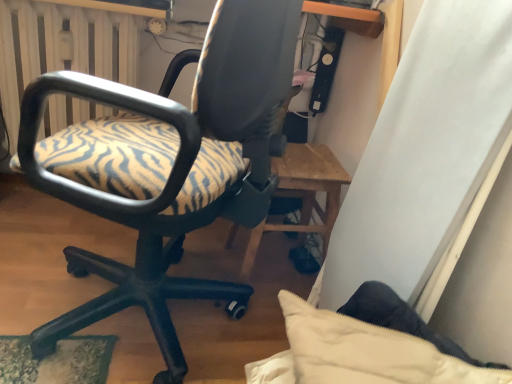
Question: From the image's perspective, is zebra-patterned fabric office chair at left over white radiator at upper left?

Choices:
 (A) no
 (B) yes

Answer: (A)

Question: Would you consider zebra-patterned fabric office chair at left to be distant from white radiator at upper left?

Choices:
 (A) no
 (B) yes

Answer: (A)

Question: Considering the relative sizes of zebra-patterned fabric office chair at left and white radiator at upper left in the image provided, is zebra-patterned fabric office chair at left smaller than white radiator at upper left?

Choices:
 (A) yes
 (B) no

Answer: (B)

Question: Does zebra-patterned fabric office chair at left turn towards white radiator at upper left?

Choices:
 (A) no
 (B) yes

Answer: (A)

Question: From the image's perspective, is zebra-patterned fabric office chair at left under white radiator at upper left?

Choices:
 (A) yes
 (B) no

Answer: (A)

Question: Would you say zebra-patterned fabric office chair at left is outside white radiator at upper left?

Choices:
 (A) no
 (B) yes

Answer: (B)

Question: Considering the relative sizes of white radiator at upper left and zebra-patterned fabric office chair at left in the image provided, is white radiator at upper left taller than zebra-patterned fabric office chair at left?

Choices:
 (A) no
 (B) yes

Answer: (A)

Question: Is zebra-patterned fabric office chair at left completely or partially inside white radiator at upper left?

Choices:
 (A) yes
 (B) no

Answer: (B)

Question: Considering the relative sizes of white radiator at upper left and zebra-patterned fabric office chair at left in the image provided, is white radiator at upper left smaller than zebra-patterned fabric office chair at left?

Choices:
 (A) yes
 (B) no

Answer: (A)

Question: Considering the relative positions of white radiator at upper left and zebra-patterned fabric office chair at left in the image provided, is white radiator at upper left to the right of zebra-patterned fabric office chair at left from the viewer's perspective?

Choices:
 (A) yes
 (B) no

Answer: (B)

Question: From a real-world perspective, is white radiator at upper left under zebra-patterned fabric office chair at left?

Choices:
 (A) yes
 (B) no

Answer: (A)

Question: Is white radiator at upper left wider than zebra-patterned fabric office chair at left?

Choices:
 (A) no
 (B) yes

Answer: (A)

Question: In terms of width, does white radiator at upper left look wider or thinner when compared to zebra-patterned fabric office chair at left?

Choices:
 (A) wide
 (B) thin

Answer: (B)